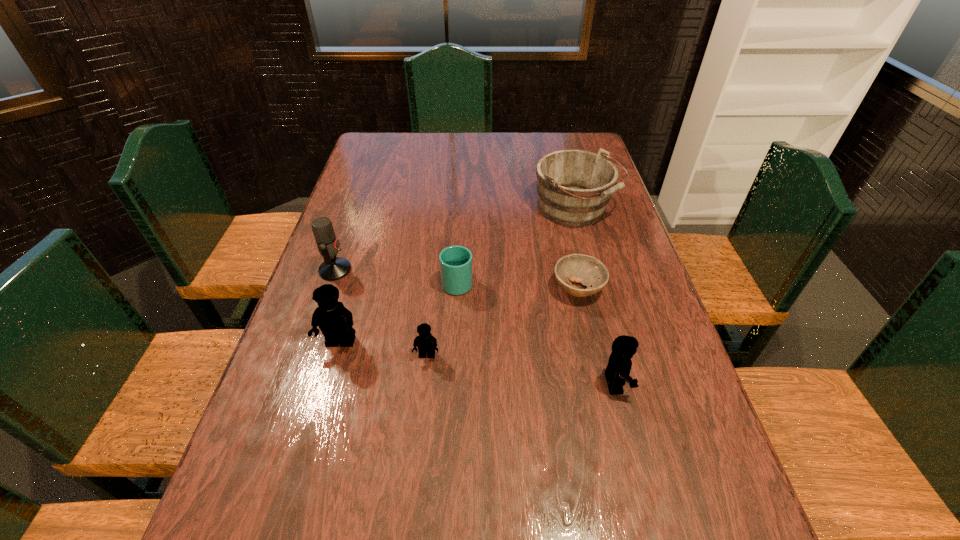
Identify the location of empty space between the shortest Lego and the cup. (443, 319).

At what (x,y) coordinates should I click in order to perform the action: click on vacant space that is in between the cup and the microphone. Please return your answer as a coordinate pair (x, y). Looking at the image, I should click on (396, 276).

Identify the location of empty location between the second Lego from left to right and the bowl. This screenshot has width=960, height=540. (502, 322).

You are a GUI agent. You are given a task and a screenshot of the screen. Output one action in this format:
    pyautogui.click(x=<x>, y=<y>)
    Task: Click on the vacant area that lies between the cup and the microphone
    The image size is (960, 540).
    Given the screenshot: What is the action you would take?
    pyautogui.click(x=396, y=276)

Find the location of a particular element. Image resolution: width=960 pixels, height=540 pixels. free space between the shortest Lego and the leftmost Lego is located at coordinates (384, 349).

You are a GUI agent. You are given a task and a screenshot of the screen. Output one action in this format:
    pyautogui.click(x=<x>, y=<y>)
    Task: Click on the free area in between the wine bucket and the microphone
    The width and height of the screenshot is (960, 540).
    Given the screenshot: What is the action you would take?
    pyautogui.click(x=455, y=240)

Point out which object is positioned as the second nearest to the rightmost Lego. Please provide its 2D coordinates. Your answer should be formatted as a tuple, i.e. [(x, y)], where the tuple contains the x and y coordinates of a point satisfying the conditions above.

[(427, 343)]

Identify the location of object that stands as the closest to the cup. The height and width of the screenshot is (540, 960). (427, 343).

Select which Lego appears as the second closest to the leftmost Lego. Please provide its 2D coordinates. Your answer should be formatted as a tuple, i.e. [(x, y)], where the tuple contains the x and y coordinates of a point satisfying the conditions above.

[(618, 369)]

I want to click on Lego that is the second nearest to the shortest Lego, so click(x=618, y=369).